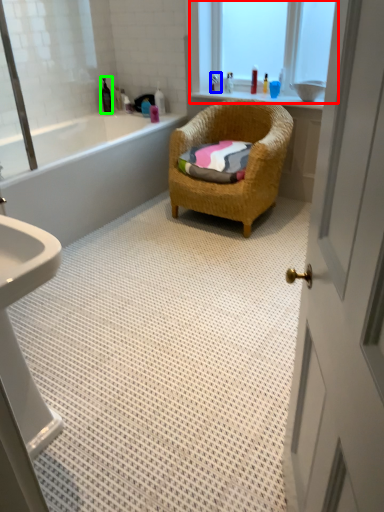
Question: Considering the real-world distances, which object is closest to window (highlighted by a red box)? toiletry (highlighted by a blue box) or toiletry (highlighted by a green box).

Choices:
 (A) toiletry
 (B) toiletry

Answer: (A)